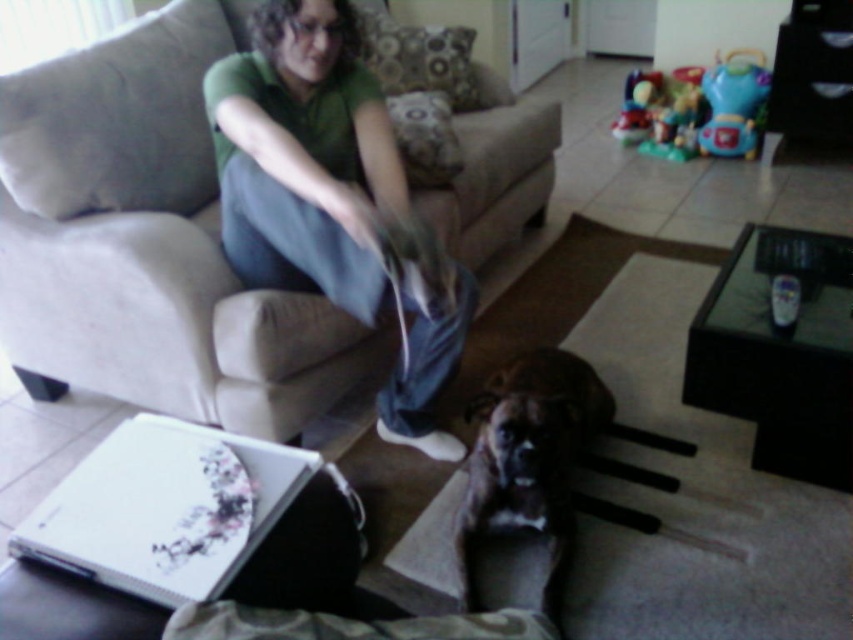
Is beige fabric couch at center shorter than green cotton shirt at center?

In fact, beige fabric couch at center may be taller than green cotton shirt at center.

Is point (198, 332) farther from camera compared to point (363, 305)?

Yes.

This screenshot has width=853, height=640. I want to click on beige fabric couch at center, so 149,243.

Measure the distance between green cotton shirt at center and brown furry dog at center.

green cotton shirt at center is 16.88 inches away from brown furry dog at center.

Can you confirm if green cotton shirt at center is smaller than brown furry dog at center?

Incorrect, green cotton shirt at center is not smaller in size than brown furry dog at center.

Is point (432, 236) positioned in front of point (477, 522)?

Yes, point (432, 236) is closer to viewer.

Identify the location of green cotton shirt at center. (334, 198).

Between beige fabric couch at center and brown furry dog at center, which one has more height?

beige fabric couch at center is taller.

Who is shorter, beige fabric couch at center or brown furry dog at center?

brown furry dog at center

The width and height of the screenshot is (853, 640). Identify the location of beige fabric couch at center. (149, 243).